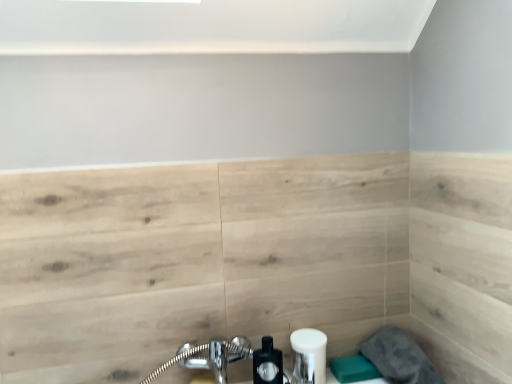
At what (x,y) coordinates should I click in order to perform the action: click on white matte soap dispenser at lower center. Please return your answer as a coordinate pair (x, y). The width and height of the screenshot is (512, 384). Looking at the image, I should click on (308, 355).

Measure the distance between point (265, 377) and camera.

A distance of 1.09 meters exists between point (265, 377) and camera.

Where is `gray fabric towel at lower right`? gray fabric towel at lower right is located at coordinates (399, 358).

Would you say white matte soap dispenser at lower center is a long distance from gray fabric towel at lower right?

No, white matte soap dispenser at lower center is in close proximity to gray fabric towel at lower right.

Is white matte soap dispenser at lower center oriented away from gray fabric towel at lower right?

No, white matte soap dispenser at lower center is not facing the opposite direction of gray fabric towel at lower right.

Which point is more distant from viewer, [320,336] or [409,366]?

The point [320,336] is farther from the camera.

Does white matte soap dispenser at lower center have a smaller size compared to gray fabric towel at lower right?

Indeed, white matte soap dispenser at lower center has a smaller size compared to gray fabric towel at lower right.

Who is shorter, gray fabric towel at lower right or white matte soap dispenser at lower center?

With less height is white matte soap dispenser at lower center.

Does gray fabric towel at lower right appear on the left side of white matte soap dispenser at lower center?

No.

Which of these two, gray fabric towel at lower right or white matte soap dispenser at lower center, is bigger?

Bigger between the two is gray fabric towel at lower right.

Where is `gray directly beneath the white matte soap dispenser at lower center (from a real-world perspective)`? gray directly beneath the white matte soap dispenser at lower center (from a real-world perspective) is located at coordinates (399, 358).

Considering the relative positions of matte black soap dispenser at lower center and white matte soap dispenser at lower center in the image provided, is matte black soap dispenser at lower center to the left of white matte soap dispenser at lower center from the viewer's perspective?

Yes.

Is matte black soap dispenser at lower center inside or outside of white matte soap dispenser at lower center?

matte black soap dispenser at lower center is not enclosed by white matte soap dispenser at lower center.

This screenshot has height=384, width=512. Identify the location of toiletry below the matte black soap dispenser at lower center (from a real-world perspective). (308, 355).

Does matte black soap dispenser at lower center have a greater width compared to white matte soap dispenser at lower center?

In fact, matte black soap dispenser at lower center might be narrower than white matte soap dispenser at lower center.

Which is closer, (388, 332) or (279, 379)?

Point (279, 379)

From the image's perspective, is gray fabric towel at lower right located above or below matte black soap dispenser at lower center?

gray fabric towel at lower right is situated lower than matte black soap dispenser at lower center in the image.

Between gray fabric towel at lower right and matte black soap dispenser at lower center, which one has larger width?

Wider between the two is gray fabric towel at lower right.

From the image's perspective, between matte black soap dispenser at lower center and gray fabric towel at lower right, who is located below?

From the image's view, gray fabric towel at lower right is below.

Considering the relative sizes of matte black soap dispenser at lower center and gray fabric towel at lower right in the image provided, is matte black soap dispenser at lower center bigger than gray fabric towel at lower right?

Incorrect, matte black soap dispenser at lower center is not larger than gray fabric towel at lower right.

Would you say matte black soap dispenser at lower center contains gray fabric towel at lower right?

Actually, gray fabric towel at lower right is outside matte black soap dispenser at lower center.

How distant is matte black soap dispenser at lower center from gray fabric towel at lower right?

matte black soap dispenser at lower center is 14.15 inches away from gray fabric towel at lower right.

Is white matte soap dispenser at lower center aimed at matte black soap dispenser at lower center?

No, white matte soap dispenser at lower center is not oriented towards matte black soap dispenser at lower center.

Measure the distance from white matte soap dispenser at lower center to matte black soap dispenser at lower center.

4.28 inches.

Based on the photo, which is closer, (x=323, y=368) or (x=266, y=336)?

Point (x=323, y=368) is positioned closer to the camera compared to point (x=266, y=336).

Where is `soap dispenser above the white matte soap dispenser at lower center (from the image's perspective)`? The width and height of the screenshot is (512, 384). soap dispenser above the white matte soap dispenser at lower center (from the image's perspective) is located at coordinates (267, 364).

Where is `gray below the white matte soap dispenser at lower center (from the image's perspective)`? gray below the white matte soap dispenser at lower center (from the image's perspective) is located at coordinates (399, 358).

I want to click on toiletry above the gray fabric towel at lower right (from a real-world perspective), so click(x=308, y=355).

From the image, which object appears to be farther from white matte soap dispenser at lower center, gray fabric towel at lower right or matte black soap dispenser at lower center?

gray fabric towel at lower right is positioned further to the anchor white matte soap dispenser at lower center.

Looking at the image, which one is located closer to white matte soap dispenser at lower center, matte black soap dispenser at lower center or gray fabric towel at lower right?

matte black soap dispenser at lower center is positioned closer to the anchor white matte soap dispenser at lower center.

Based on their spatial positions, is white matte soap dispenser at lower center or gray fabric towel at lower right further from matte black soap dispenser at lower center?

Among the two, gray fabric towel at lower right is located further to matte black soap dispenser at lower center.

From the picture: Looking at the image, which one is located closer to gray fabric towel at lower right, matte black soap dispenser at lower center or white matte soap dispenser at lower center?

Among the two, white matte soap dispenser at lower center is located nearer to gray fabric towel at lower right.

Based on their spatial positions, is gray fabric towel at lower right or white matte soap dispenser at lower center closer to matte black soap dispenser at lower center?

Based on the image, white matte soap dispenser at lower center appears to be nearer to matte black soap dispenser at lower center.

Estimate the real-world distances between objects in this image. Which object is further from gray fabric towel at lower right, white matte soap dispenser at lower center or matte black soap dispenser at lower center?

Based on the image, matte black soap dispenser at lower center appears to be further to gray fabric towel at lower right.

The width and height of the screenshot is (512, 384). In order to click on toiletry between matte black soap dispenser at lower center and gray fabric towel at lower right in this screenshot , I will do `click(308, 355)`.